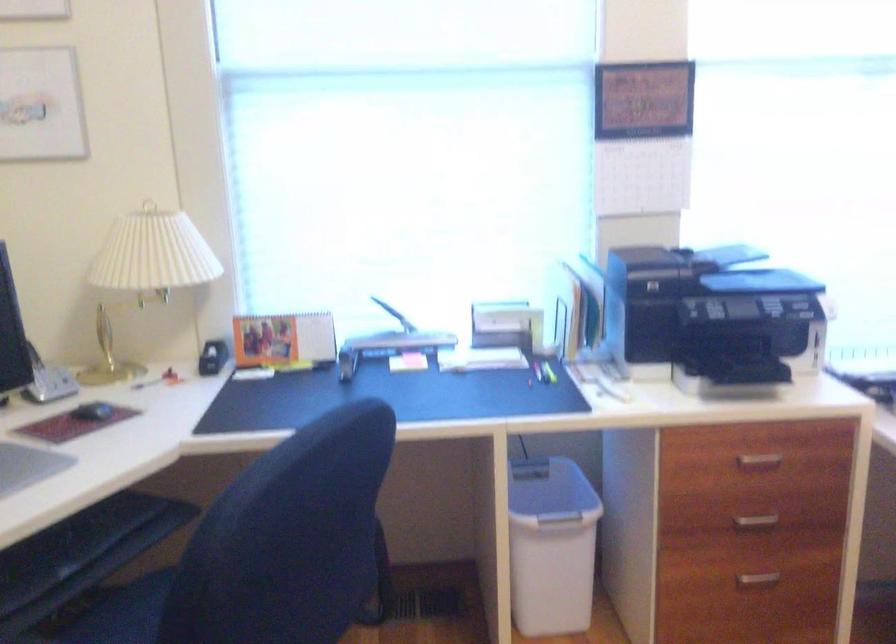
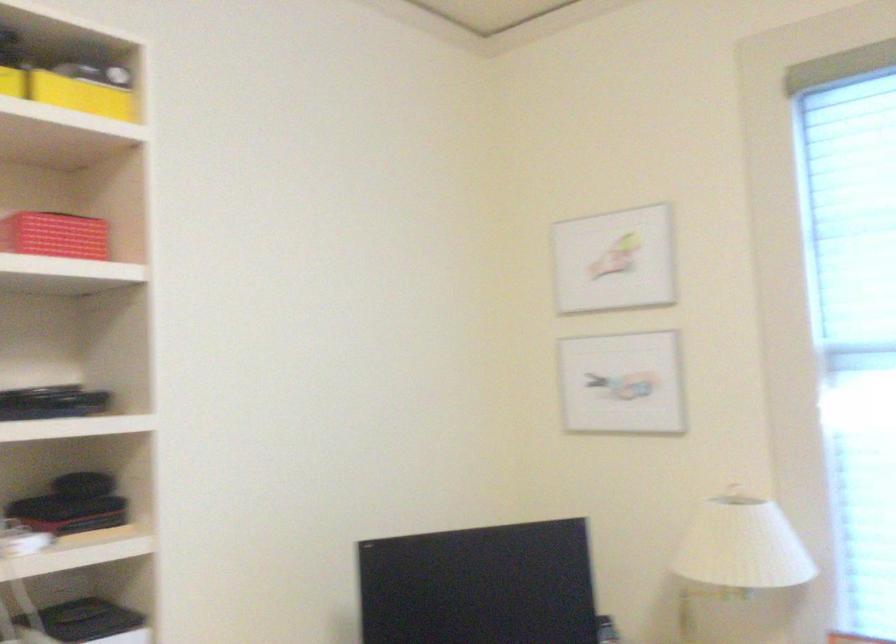
Question: Based on the continuous images, in which direction is the camera rotating? Reply with the corresponding letter.

Choices:
 (A) Left
 (B) Right
 (C) Up
 (D) Down

Answer: (A)